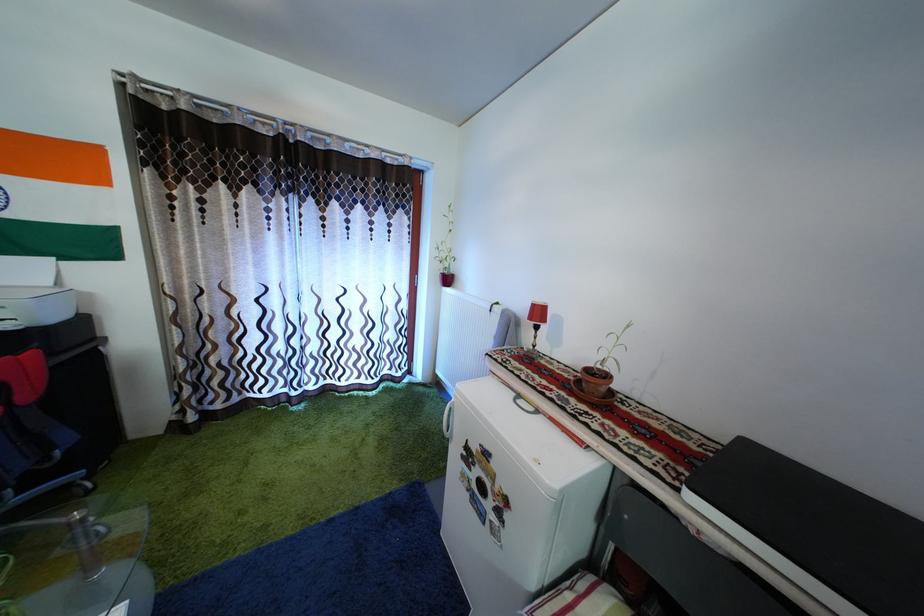
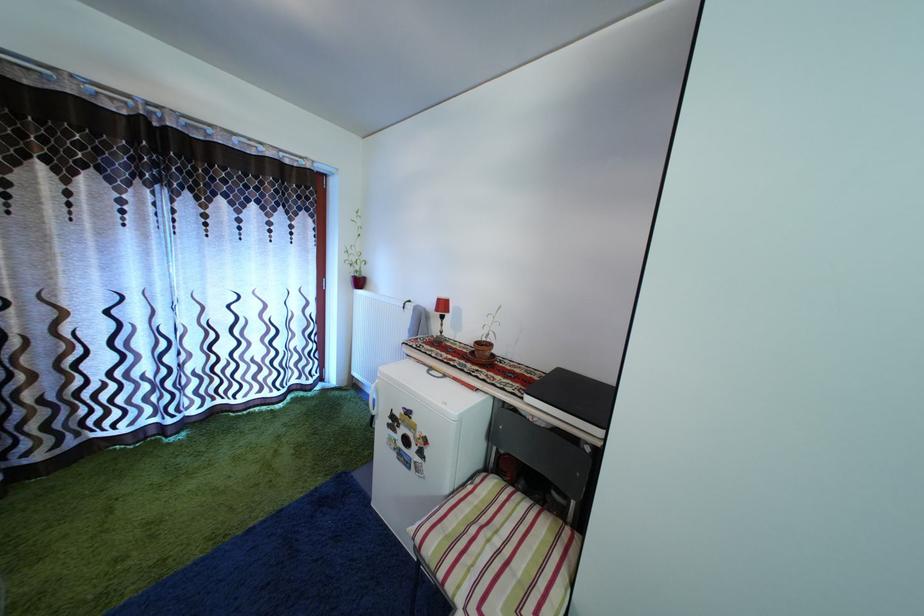
The point at (594, 378) is marked in the first image. Where is the corresponding point in the second image?

(485, 350)